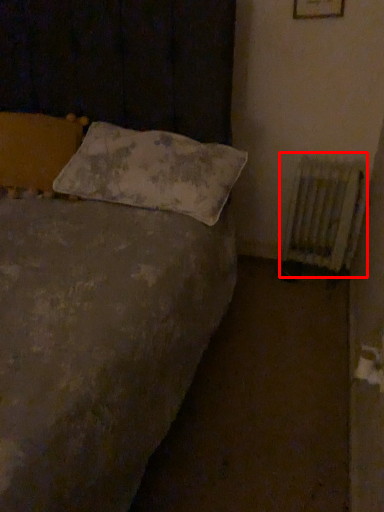
Question: From the image's perspective, where is radiator (annotated by the red box) located relative to pillow?

Choices:
 (A) above
 (B) below

Answer: (B)